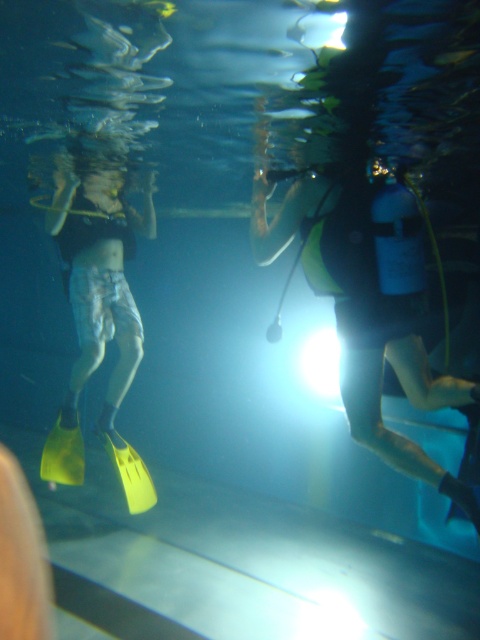
Question: Which is farther from the yellow matte paddle at lower center?

Choices:
 (A) yellow matte scuba gear at center
 (B) yellow rubber fins at left

Answer: (A)

Question: Can you confirm if yellow matte scuba gear at center is smaller than yellow rubber fins at left?

Choices:
 (A) yes
 (B) no

Answer: (A)

Question: Does yellow rubber fins at left have a lesser width compared to yellow matte paddle at lower center?

Choices:
 (A) yes
 (B) no

Answer: (B)

Question: Observing the image, what is the correct spatial positioning of yellow matte scuba gear at center in reference to yellow rubber fins at left?

Choices:
 (A) left
 (B) right

Answer: (B)

Question: Among these objects, which one is nearest to the camera?

Choices:
 (A) yellow rubber fins at left
 (B) yellow matte paddle at lower center

Answer: (A)

Question: Estimate the real-world distances between objects in this image. Which object is closer to the yellow rubber fins at left?

Choices:
 (A) yellow matte paddle at lower center
 (B) yellow matte scuba gear at center

Answer: (A)